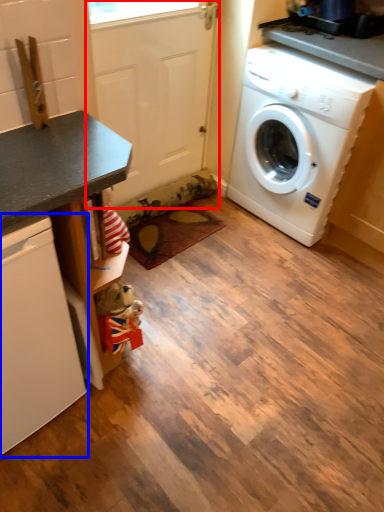
Question: Which point is further to the camera, screen door (highlighted by a red box) or dish washer (highlighted by a blue box)?

Choices:
 (A) screen door
 (B) dish washer

Answer: (A)